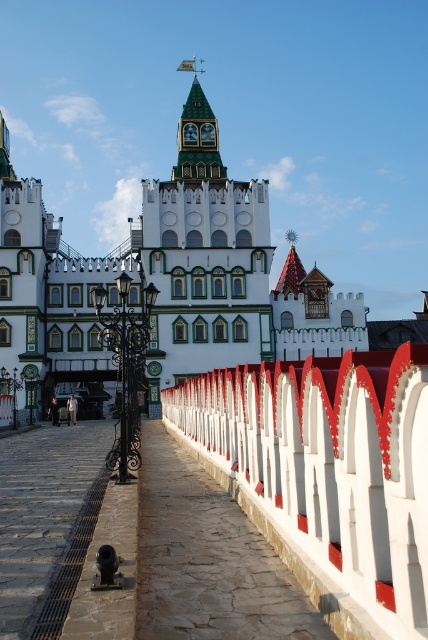
Is green matte tower at center in front of green stone clock tower at upper center?

Yes.

Consider the image. Who is more forward, (x=181, y=349) or (x=217, y=164)?

Positioned in front is point (x=181, y=349).

Find the location of `green matte tower at center`. green matte tower at center is located at coordinates (204, 257).

Can you confirm if stone paved path at center is bigger than green matte tower at center?

Actually, stone paved path at center might be smaller than green matte tower at center.

Which is above, stone paved path at center or green matte tower at center?

Positioned higher is green matte tower at center.

Find the location of a particular element. stone paved path at center is located at coordinates (134, 547).

Between white painted wood fence at center and green matte tower at center, which one has more height?

green matte tower at center is taller.

Does white painted wood fence at center appear under green matte tower at center?

Indeed, white painted wood fence at center is positioned under green matte tower at center.

Find the location of a particular element. The height and width of the screenshot is (640, 428). white painted wood fence at center is located at coordinates [326, 474].